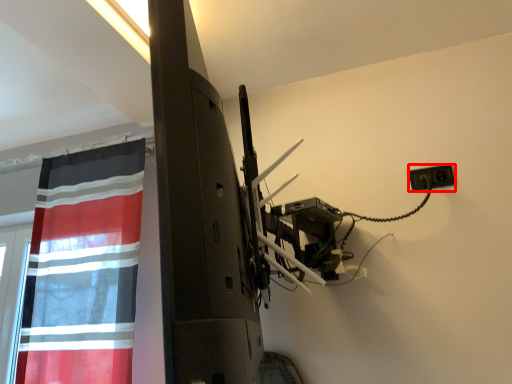
Question: From the image's perspective, where is electric outlet (annotated by the red box) located in relation to curtain in the image?

Choices:
 (A) above
 (B) below

Answer: (A)